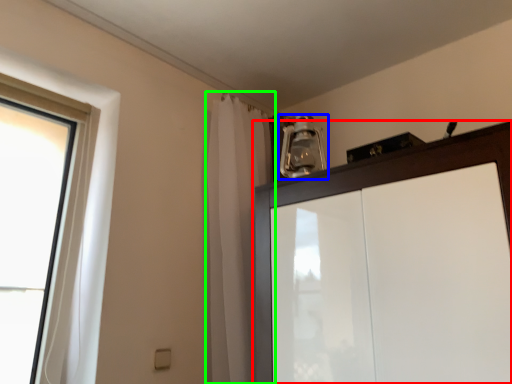
Question: Based on their relative distances, which object is nearer to cupboard (highlighted by a red box)? Choose from light fixture (highlighted by a blue box) and shower curtain (highlighted by a green box).

Choices:
 (A) light fixture
 (B) shower curtain

Answer: (B)